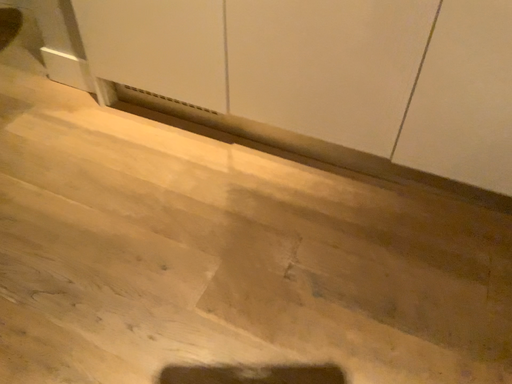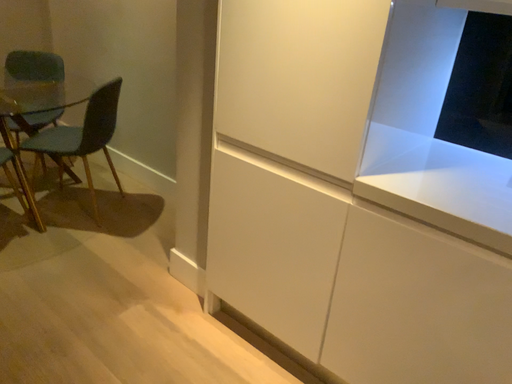
Question: How did the camera likely rotate when shooting the video?

Choices:
 (A) rotated downward
 (B) rotated upward

Answer: (B)